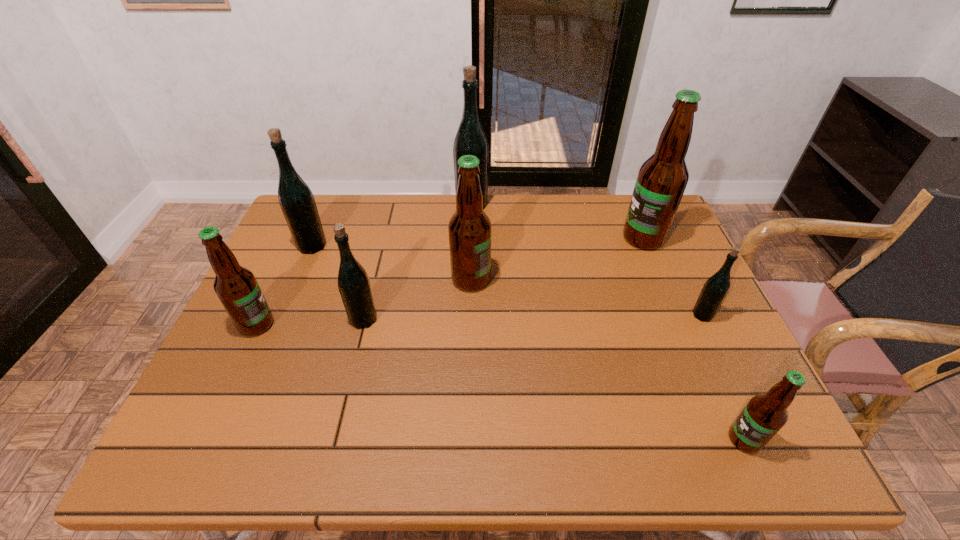
This screenshot has width=960, height=540. I want to click on the second smallest green beer bottle, so click(x=353, y=282).

Image resolution: width=960 pixels, height=540 pixels. Find the location of `the nearest object`. the nearest object is located at coordinates (764, 415).

Locate an element on the screen. the smallest brown beer bottle is located at coordinates (764, 415).

You are a GUI agent. You are given a task and a screenshot of the screen. Output one action in this format:
    pyautogui.click(x=<x>, y=<y>)
    Task: Click on the rightmost green beer bottle
    
    Given the screenshot: What is the action you would take?
    pyautogui.click(x=716, y=288)

Where is `vacant position located on the front of the farthest object`? vacant position located on the front of the farthest object is located at coordinates (470, 253).

Where is `vacant space positioned 0.320m on the label of the farthest brown beer bottle`? This screenshot has width=960, height=540. vacant space positioned 0.320m on the label of the farthest brown beer bottle is located at coordinates (519, 238).

The height and width of the screenshot is (540, 960). What are the coordinates of `free space located 0.390m on the label of the farthest brown beer bottle` in the screenshot? It's located at (496, 238).

Identify the location of vacant space located on the label of the farthest brown beer bottle. Image resolution: width=960 pixels, height=540 pixels. (551, 238).

You are a GUI agent. You are given a task and a screenshot of the screen. Output one action in this format:
    pyautogui.click(x=<x>, y=<y>)
    Task: Click on the free space located 0.190m on the right of the third smallest green beer bottle
    
    Given the screenshot: What is the action you would take?
    pyautogui.click(x=389, y=246)

The width and height of the screenshot is (960, 540). What are the coordinates of `vacant space situated on the label of the fifth nearest object` in the screenshot? It's located at (605, 280).